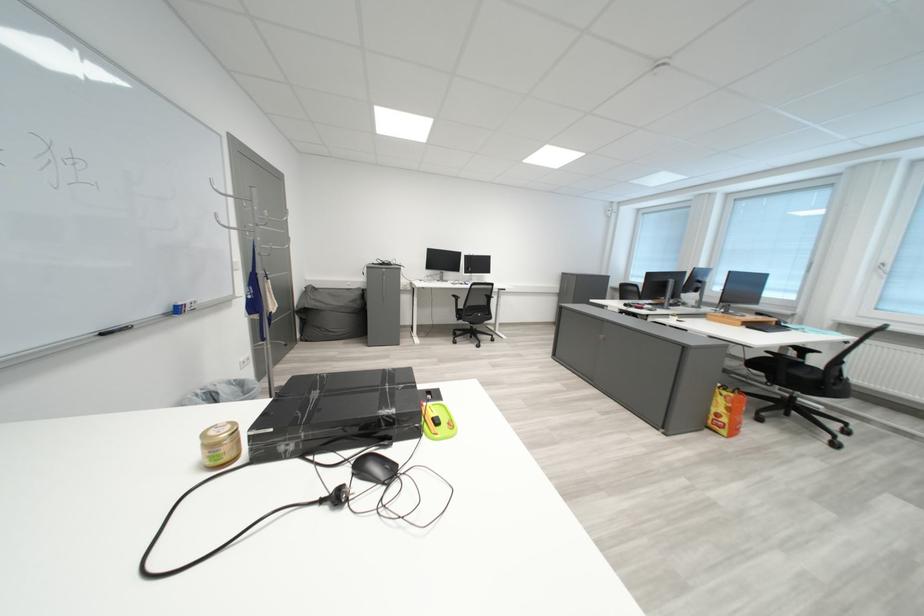
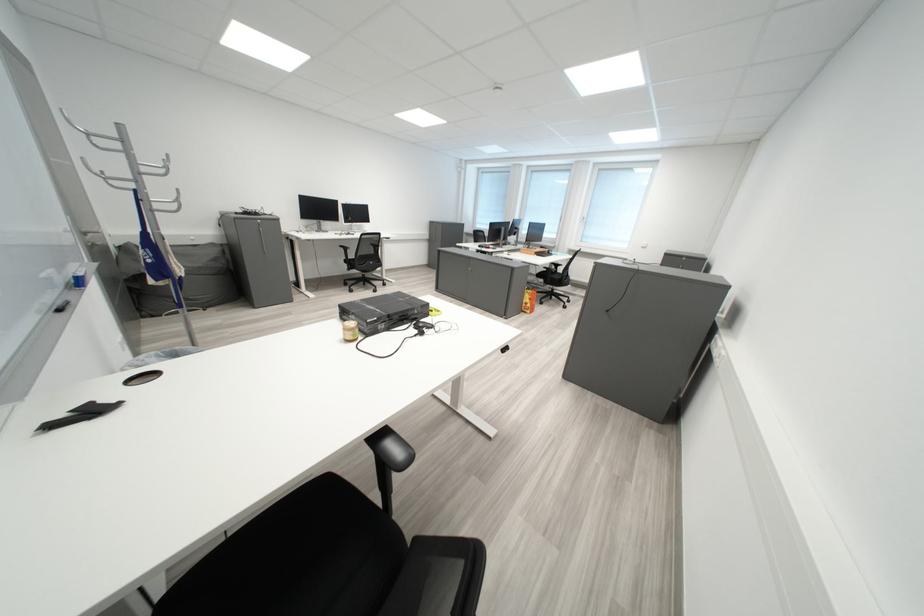
Locate, in the second image, the point that corresponds to [786,383] in the first image.

(560, 285)